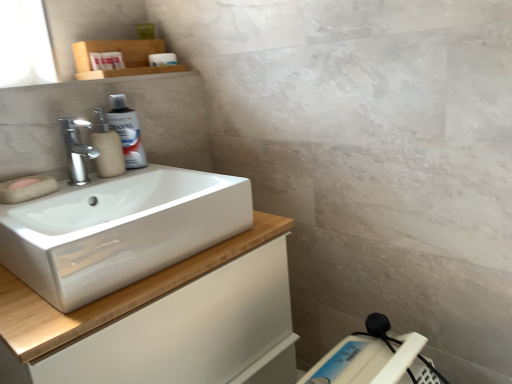
Question: In terms of size, does white plastic scale at lower right appear bigger or smaller than beige matte soap dispenser at left?

Choices:
 (A) big
 (B) small

Answer: (A)

Question: From the image's perspective, is white plastic scale at lower right positioned above or below beige matte soap dispenser at left?

Choices:
 (A) below
 (B) above

Answer: (A)

Question: Which object is the closest to the white plastic scale at lower right?

Choices:
 (A) pink sponge at left
 (B) polished chrome faucet at upper left
 (C) silver metallic spray can at upper left
 (D) white glossy cabinet at lower left
 (E) beige matte soap dispenser at left

Answer: (D)

Question: Which of these objects is positioned closest to the polished chrome faucet at upper left?

Choices:
 (A) pink sponge at left
 (B) white glossy sink at left
 (C) silver metallic spray can at upper left
 (D) white glossy cabinet at lower left
 (E) beige matte soap dispenser at left

Answer: (E)